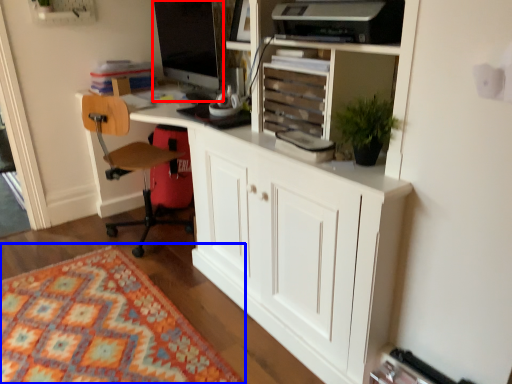
Question: Which object appears farthest to the camera in this image, computer monitor (highlighted by a red box) or mat (highlighted by a blue box)?

Choices:
 (A) computer monitor
 (B) mat

Answer: (A)